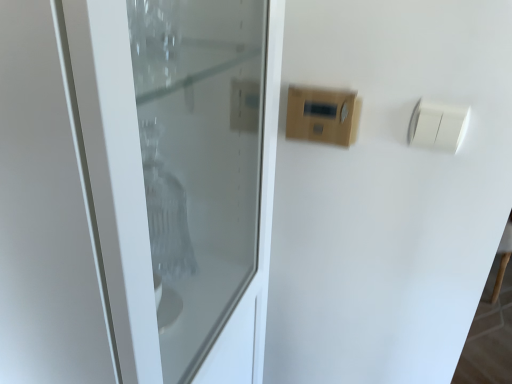
Question: In which direction should I rotate to look at wooden panel at upper center, placed as the first light switch when sorted from left to right?

Choices:
 (A) right
 (B) left

Answer: (A)

Question: Does white glossy door at center have a lesser height compared to white plastic light switch at upper right, acting as the 2th light switch starting from the left?

Choices:
 (A) yes
 (B) no

Answer: (B)

Question: Is white glossy door at center not inside white plastic light switch at upper right, the first light switch positioned from the right?

Choices:
 (A) yes
 (B) no

Answer: (A)

Question: Can you confirm if white glossy door at center is wider than white plastic light switch at upper right, acting as the 2th light switch starting from the left?

Choices:
 (A) no
 (B) yes

Answer: (B)

Question: Does white glossy door at center have a larger size compared to white plastic light switch at upper right, the first light switch positioned from the right?

Choices:
 (A) no
 (B) yes

Answer: (B)

Question: From a real-world perspective, is white glossy door at center located beneath white plastic light switch at upper right, the first light switch positioned from the right?

Choices:
 (A) yes
 (B) no

Answer: (A)

Question: From a real-world perspective, is white glossy door at center over white plastic light switch at upper right, the first light switch positioned from the right?

Choices:
 (A) no
 (B) yes

Answer: (A)

Question: Can you confirm if white glossy door at center is positioned to the right of wooden panel at upper center, placed as the first light switch when sorted from left to right?

Choices:
 (A) no
 (B) yes

Answer: (A)

Question: Does white glossy door at center have a greater height compared to wooden panel at upper center, placed as the first light switch when sorted from left to right?

Choices:
 (A) yes
 (B) no

Answer: (A)

Question: Is white glossy door at center not inside wooden panel at upper center, placed as the first light switch when sorted from left to right?

Choices:
 (A) yes
 (B) no

Answer: (A)

Question: Does white glossy door at center appear on the left side of wooden panel at upper center, which is the second light switch in right-to-left order?

Choices:
 (A) yes
 (B) no

Answer: (A)

Question: Is white glossy door at center surrounding wooden panel at upper center, which is the second light switch in right-to-left order?

Choices:
 (A) yes
 (B) no

Answer: (B)

Question: Could you tell me if white glossy door at center is facing wooden panel at upper center, which is the second light switch in right-to-left order?

Choices:
 (A) yes
 (B) no

Answer: (B)

Question: Does white plastic light switch at upper right, the first light switch positioned from the right, have a larger size compared to wooden panel at upper center, placed as the first light switch when sorted from left to right?

Choices:
 (A) yes
 (B) no

Answer: (B)